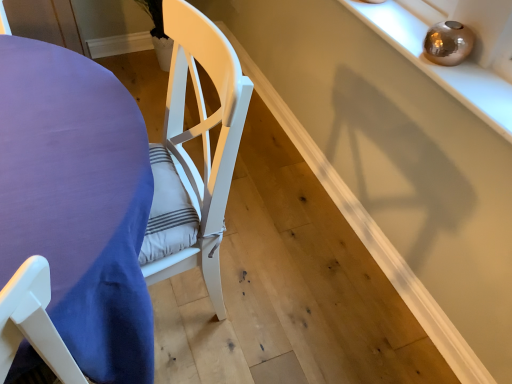
Question: Does shiny metallic orb at upper right have a lesser width compared to purple fabric table at left?

Choices:
 (A) no
 (B) yes

Answer: (B)

Question: From a real-world perspective, is shiny metallic orb at upper right over purple fabric table at left?

Choices:
 (A) no
 (B) yes

Answer: (B)

Question: Considering the relative sizes of shiny metallic orb at upper right and purple fabric table at left in the image provided, is shiny metallic orb at upper right taller than purple fabric table at left?

Choices:
 (A) yes
 (B) no

Answer: (B)

Question: From the image's perspective, would you say shiny metallic orb at upper right is shown under purple fabric table at left?

Choices:
 (A) yes
 (B) no

Answer: (B)

Question: Is shiny metallic orb at upper right touching purple fabric table at left?

Choices:
 (A) yes
 (B) no

Answer: (B)

Question: Does shiny metallic orb at upper right have a larger size compared to purple fabric table at left?

Choices:
 (A) yes
 (B) no

Answer: (B)

Question: Considering the relative sizes of purple fabric table at left and shiny metallic orb at upper right in the image provided, is purple fabric table at left bigger than shiny metallic orb at upper right?

Choices:
 (A) no
 (B) yes

Answer: (B)

Question: Are purple fabric table at left and shiny metallic orb at upper right far apart?

Choices:
 (A) yes
 (B) no

Answer: (B)

Question: Does purple fabric table at left touch shiny metallic orb at upper right?

Choices:
 (A) yes
 (B) no

Answer: (B)

Question: From the image's perspective, is purple fabric table at left above shiny metallic orb at upper right?

Choices:
 (A) yes
 (B) no

Answer: (B)

Question: Can you confirm if purple fabric table at left is positioned to the left of shiny metallic orb at upper right?

Choices:
 (A) no
 (B) yes

Answer: (B)

Question: Does purple fabric table at left have a lesser width compared to shiny metallic orb at upper right?

Choices:
 (A) no
 (B) yes

Answer: (A)

Question: From a real-world perspective, is purple fabric table at left positioned above or below shiny metallic orb at upper right?

Choices:
 (A) below
 (B) above

Answer: (A)